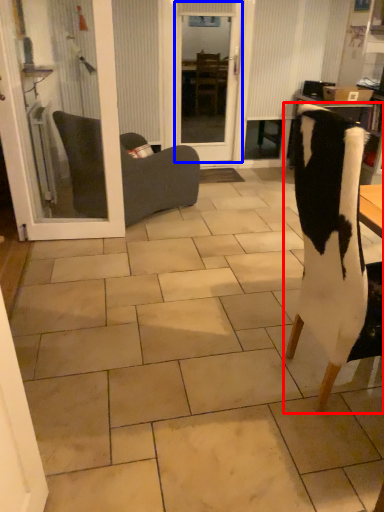
Question: Which of the following is the farthest to the observer, chair (highlighted by a red box) or screen door (highlighted by a blue box)?

Choices:
 (A) chair
 (B) screen door

Answer: (B)